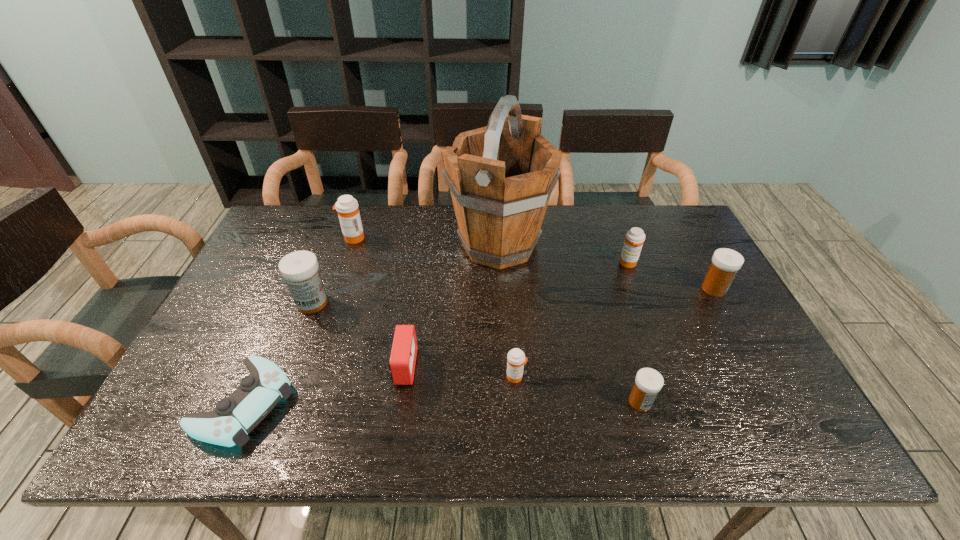
Locate an element on the screen. The image size is (960, 540). the smallest white medicine is located at coordinates (648, 382).

You are a GUI agent. You are given a task and a screenshot of the screen. Output one action in this format:
    pyautogui.click(x=<x>, y=<y>)
    Task: Click on the second white medicine from right to left
    
    Given the screenshot: What is the action you would take?
    pyautogui.click(x=648, y=382)

Find the location of `the smallest orange medicine`. the smallest orange medicine is located at coordinates (516, 359).

Locate an element on the screen. The height and width of the screenshot is (540, 960). the third medicine from left to right is located at coordinates (516, 359).

Image resolution: width=960 pixels, height=540 pixels. What are the coordinates of `the shortest object` in the screenshot? It's located at (234, 417).

Image resolution: width=960 pixels, height=540 pixels. In order to click on vacant space located on the left of the tallest object in this screenshot , I will do point(403,245).

Identify the location of free space located on the front of the biggest white medicine. The height and width of the screenshot is (540, 960). (287, 368).

You are a GUI agent. You are given a task and a screenshot of the screen. Output one action in this format:
    pyautogui.click(x=<x>, y=<y>)
    Task: Click on the vacant space located on the front of the farthest medicine
    This screenshot has height=540, width=960.
    Given the screenshot: What is the action you would take?
    pyautogui.click(x=337, y=286)

The height and width of the screenshot is (540, 960). Find the location of `blank space located on the left of the rightmost medicine`. blank space located on the left of the rightmost medicine is located at coordinates (662, 289).

You are a GUI agent. You are given a task and a screenshot of the screen. Output one action in this format:
    pyautogui.click(x=<x>, y=<y>)
    Task: Click on the free space located 0.320m on the left of the rightmost orange medicine
    
    Given the screenshot: What is the action you would take?
    pyautogui.click(x=515, y=264)